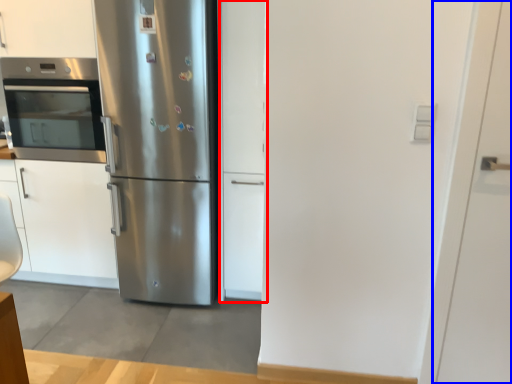
Question: Among these objects, which one is nearest to the camera, door (highlighted by a red box) or door (highlighted by a blue box)?

Choices:
 (A) door
 (B) door

Answer: (B)